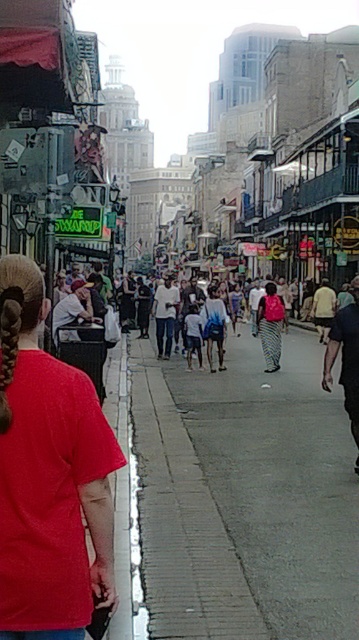
Question: Among these points, which one is nearest to the camera?

Choices:
 (A) (2, 353)
 (B) (218, 321)
 (C) (71, 445)
 (D) (160, 340)

Answer: (A)

Question: Is gray concrete sidewalk at center to the left of red t-shirt at center from the viewer's perspective?

Choices:
 (A) yes
 (B) no

Answer: (B)

Question: Which of the following is the closest to the observer?

Choices:
 (A) blue denim shorts at center
 (B) red t-shirt at center
 (C) dark gray pants at right
 (D) light yellow shirt at center

Answer: (B)

Question: Does red t-shirt at center lie in front of patterned fabric dress at center?

Choices:
 (A) yes
 (B) no

Answer: (A)

Question: Is patterned fabric dress at center closer to the viewer compared to light yellow shirt at center?

Choices:
 (A) no
 (B) yes

Answer: (B)

Question: Which point is closer to the camera?

Choices:
 (A) (171, 305)
 (B) (208, 298)
 (C) (277, 304)

Answer: (C)